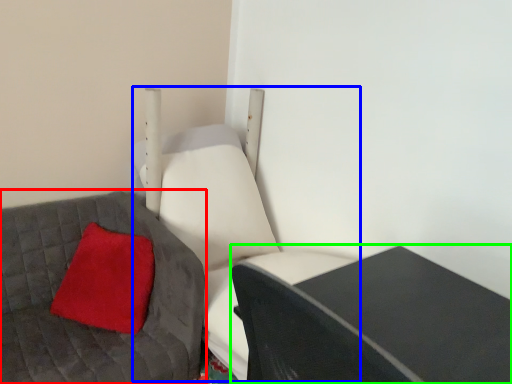
Question: Which is farther away from furniture (highlighted by a red box)? swivel chair (highlighted by a blue box) or table (highlighted by a green box)?

Choices:
 (A) swivel chair
 (B) table

Answer: (B)